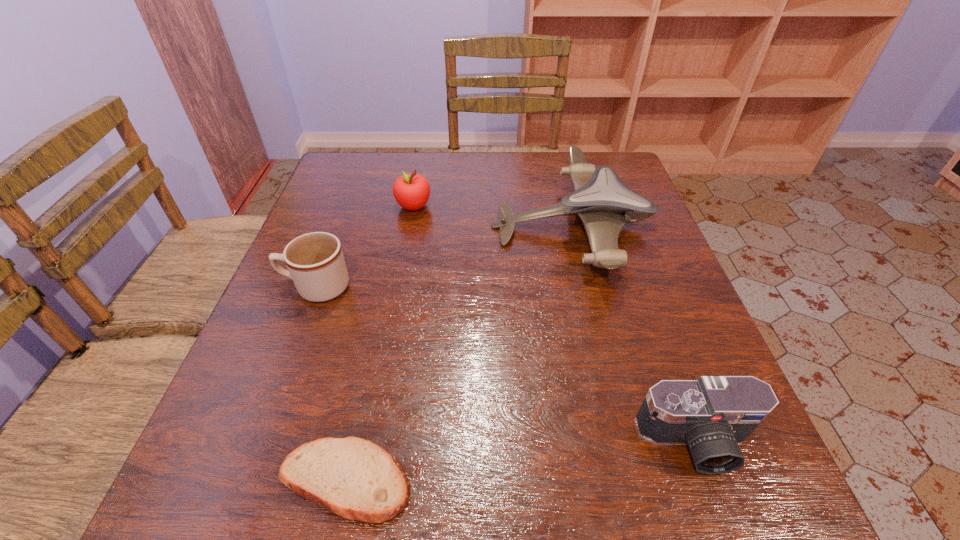
This screenshot has height=540, width=960. What are the coordinates of `apple` in the screenshot? It's located at (411, 191).

Where is `drone`? drone is located at coordinates (603, 202).

What are the coordinates of `mug` in the screenshot? It's located at (315, 261).

Identify the location of camera. (713, 414).

You are a GUI agent. You are given a task and a screenshot of the screen. Output one action in this format:
    pyautogui.click(x=<x>, y=<y>)
    Task: Click on the pita bread
    The width and height of the screenshot is (960, 540).
    Given the screenshot: What is the action you would take?
    pyautogui.click(x=352, y=477)

You are a GUI agent. You are given a task and a screenshot of the screen. Output one action in this format:
    pyautogui.click(x=<x>, y=<y>)
    Task: Click on the blank space located 0.060m on the front of the apple
    The width and height of the screenshot is (960, 540).
    Given the screenshot: What is the action you would take?
    pyautogui.click(x=409, y=232)

The width and height of the screenshot is (960, 540). I want to click on free space located on the front-facing side of the drone, so click(x=333, y=226).

Where is `vacant space located 0.320m on the front-facing side of the drone`? The height and width of the screenshot is (540, 960). vacant space located 0.320m on the front-facing side of the drone is located at coordinates (361, 226).

Image resolution: width=960 pixels, height=540 pixels. What are the coordinates of `free point located 0.240m on the front-facing side of the drone` in the screenshot? It's located at (394, 226).

Find the location of a particular element. Image resolution: width=960 pixels, height=540 pixels. vacant space situated on the back of the pita bread is located at coordinates (386, 287).